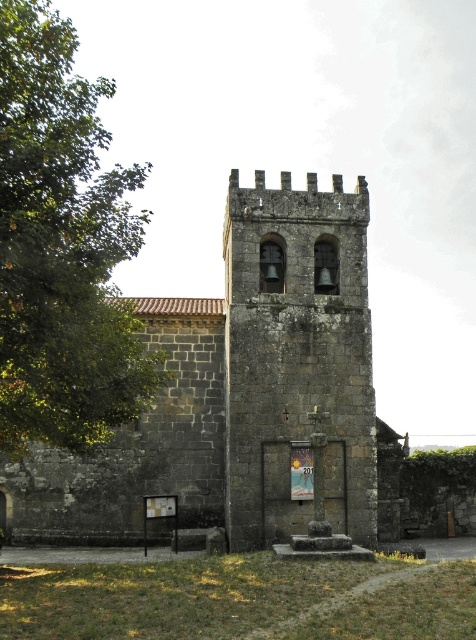
You are standing in front of the historic stone church and want to take a photo of both the green leafy tree at left and the stone bell tower at center. Which object should you position closer to the left side of your camera frame?

The green leafy tree at left is to the left of the stone bell tower at center, so you should position the green leafy tree at left closer to the left side of your camera frame.

You are standing in front of the historic stone church and want to take a photo of the stone bell tower at center. However, there is a green leafy tree at left blocking your view. Can you determine if the tree is taller than the bell tower?

The green leafy tree at left is much taller than the stone bell tower at center, so it will likely block your view of the tower.